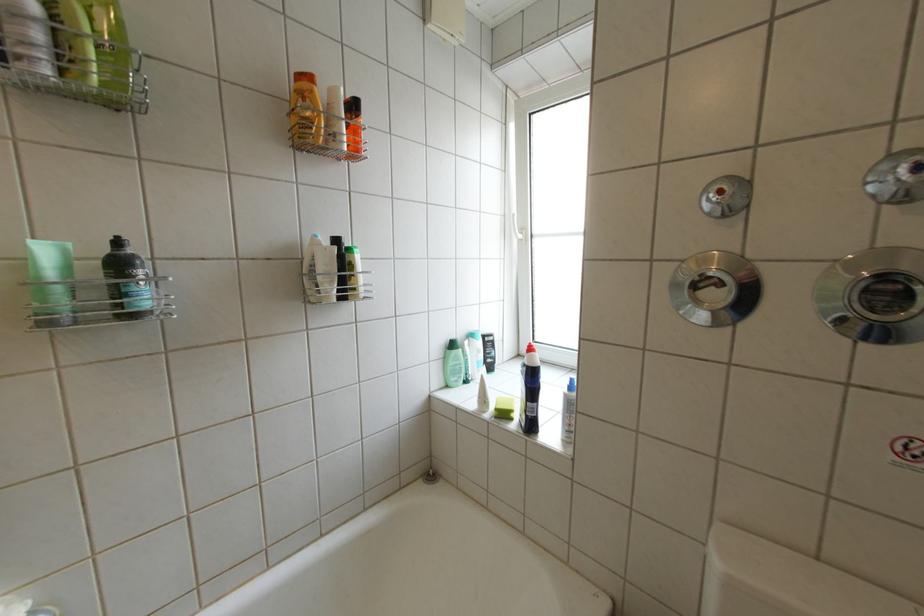
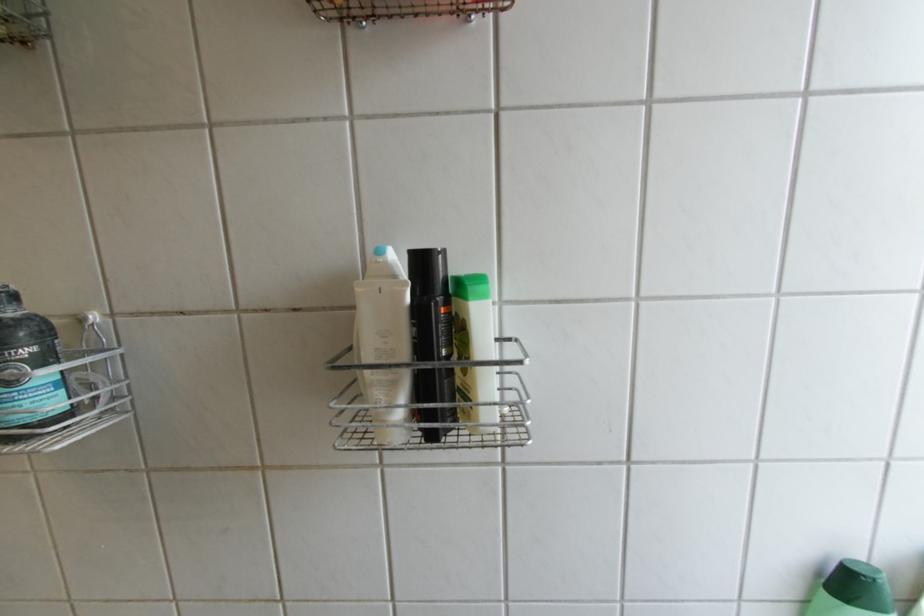
The point at (460, 352) is marked in the first image. Where is the corresponding point in the second image?

(839, 596)